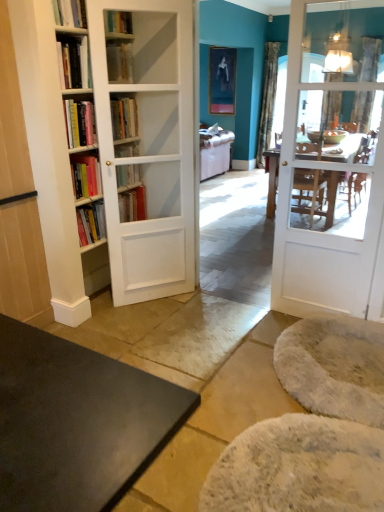
Question: Considering the relative sizes of metallic glass lampshade at upper right and matte black portrait at upper center in the image provided, is metallic glass lampshade at upper right shorter than matte black portrait at upper center?

Choices:
 (A) no
 (B) yes

Answer: (B)

Question: Is metallic glass lampshade at upper right to the left of matte black portrait at upper center from the viewer's perspective?

Choices:
 (A) yes
 (B) no

Answer: (B)

Question: Is metallic glass lampshade at upper right far from matte black portrait at upper center?

Choices:
 (A) no
 (B) yes

Answer: (B)

Question: From a real-world perspective, is metallic glass lampshade at upper right located beneath matte black portrait at upper center?

Choices:
 (A) yes
 (B) no

Answer: (B)

Question: Would you say metallic glass lampshade at upper right is outside matte black portrait at upper center?

Choices:
 (A) yes
 (B) no

Answer: (A)

Question: From their relative heights in the image, would you say light brown wood cabinet at left is taller or shorter than gray fuzzy yoga mat at lower right, which appears as the 2th yoga mat when viewed from the back?

Choices:
 (A) short
 (B) tall

Answer: (B)

Question: Considering the positions of light brown wood cabinet at left and gray fuzzy yoga mat at lower right, which is the 1th yoga mat in front-to-back order, in the image, is light brown wood cabinet at left wider or thinner than gray fuzzy yoga mat at lower right, which is the 1th yoga mat in front-to-back order,?

Choices:
 (A) thin
 (B) wide

Answer: (A)

Question: From the image's perspective, is light brown wood cabinet at left above or below gray fuzzy yoga mat at lower right, which is the 1th yoga mat in front-to-back order?

Choices:
 (A) above
 (B) below

Answer: (A)

Question: From a real-world perspective, is light brown wood cabinet at left physically located above or below gray fuzzy yoga mat at lower right, which appears as the 2th yoga mat when viewed from the back?

Choices:
 (A) below
 (B) above

Answer: (B)

Question: From the image's perspective, relative to silky teal curtain at upper right, is light brown wood cabinet at left above or below?

Choices:
 (A) above
 (B) below

Answer: (B)

Question: In terms of width, does light brown wood cabinet at left look wider or thinner when compared to silky teal curtain at upper right?

Choices:
 (A) wide
 (B) thin

Answer: (A)

Question: Considering the positions of light brown wood cabinet at left and silky teal curtain at upper right in the image, is light brown wood cabinet at left bigger or smaller than silky teal curtain at upper right?

Choices:
 (A) big
 (B) small

Answer: (A)

Question: Considering the positions of light brown wood cabinet at left and silky teal curtain at upper right in the image, is light brown wood cabinet at left taller or shorter than silky teal curtain at upper right?

Choices:
 (A) tall
 (B) short

Answer: (B)

Question: In the image, is hardcover book at upper center on the left side or the right side of white fluffy yoga mat at lower right, positioned as the 1th yoga mat in back-to-front order?

Choices:
 (A) left
 (B) right

Answer: (A)

Question: Is hardcover book at upper center inside the boundaries of white fluffy yoga mat at lower right, positioned as the 1th yoga mat in back-to-front order, or outside?

Choices:
 (A) outside
 (B) inside

Answer: (A)